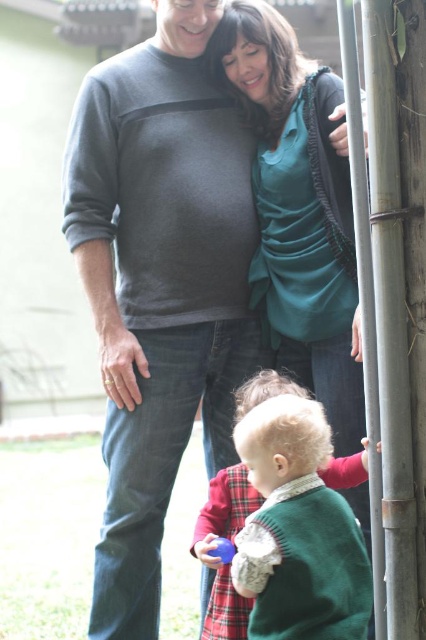
Based on the scene description, which object has a greater height between the dark gray sweater at upper left and the green knitted sweater at lower center?

The dark gray sweater at upper left has a greater height compared to the green knitted sweater at lower center.